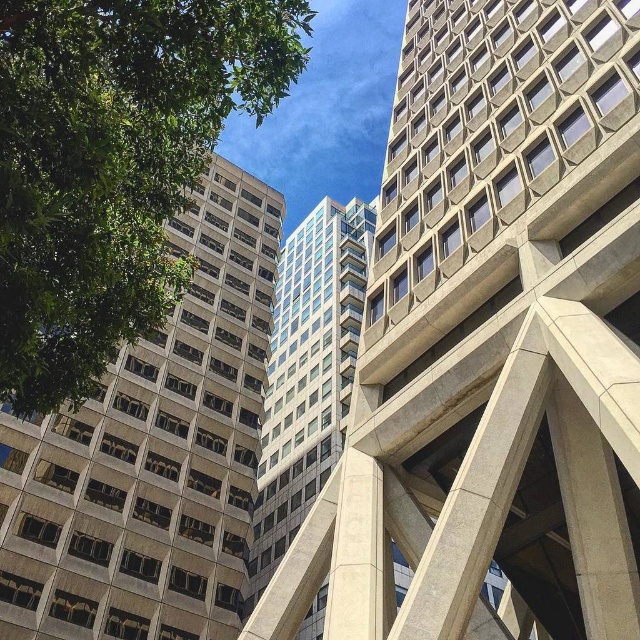
Question: Which is farther from the glassy concrete building at center?

Choices:
 (A) green leafy tree at left
 (B) concrete textured building at center

Answer: (A)

Question: Is concrete textured building at center positioned at the back of gray concrete building at left?

Choices:
 (A) no
 (B) yes

Answer: (B)

Question: Observing the image, what is the correct spatial positioning of concrete textured building at center in reference to gray concrete building at left?

Choices:
 (A) below
 (B) above

Answer: (B)

Question: Which of the following is the closest to the observer?

Choices:
 (A) green leafy tree at left
 (B) concrete textured building at center
 (C) gray concrete building at left
 (D) glassy concrete building at center

Answer: (A)

Question: Among these objects, which one is farthest from the camera?

Choices:
 (A) green leafy tree at left
 (B) gray concrete building at left
 (C) concrete textured building at center
 (D) glassy concrete building at center

Answer: (D)

Question: Does concrete textured building at center appear over green leafy tree at left?

Choices:
 (A) no
 (B) yes

Answer: (B)